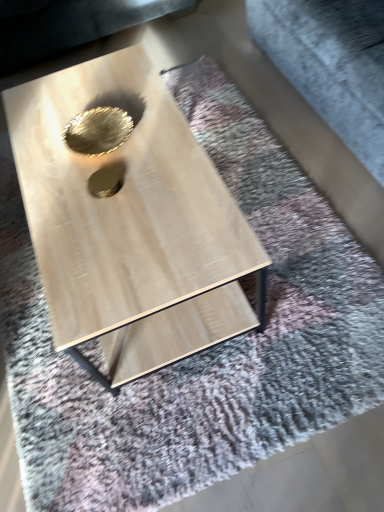
Locate an element on the screen. Image resolution: width=384 pixels, height=512 pixels. unoccupied area behind gold metallic hole at center, placed as the 1th hole when sorted from bottom to top is located at coordinates (101, 141).